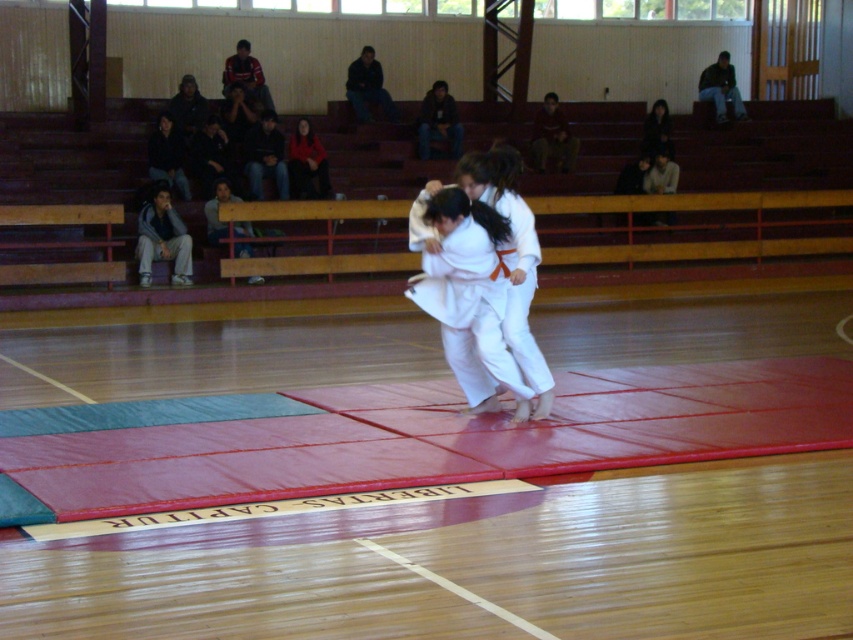
Question: Considering the relative positions of white cotton kimono at center and red velvet sweater at center in the image provided, where is white cotton kimono at center located with respect to red velvet sweater at center?

Choices:
 (A) right
 (B) left

Answer: (A)

Question: Considering the real-world distances, which object is farthest from the dark fabric jacket at upper left?

Choices:
 (A) white cotton kimono at center
 (B) red velvet sweater at center
 (C) dark brown hair at upper right

Answer: (A)

Question: Considering the relative positions of red velvet sweater at center and dark fabric jacket at upper left in the image provided, where is red velvet sweater at center located with respect to dark fabric jacket at upper left?

Choices:
 (A) above
 (B) below

Answer: (A)

Question: Which point is closer to the camera?

Choices:
 (A) (672, 147)
 (B) (306, 132)

Answer: (B)

Question: Which point appears farthest from the camera in this image?

Choices:
 (A) (657, 122)
 (B) (299, 141)
 (C) (164, 168)

Answer: (A)

Question: Can you confirm if white cotton kimono at center is thinner than dark brown hair at upper right?

Choices:
 (A) yes
 (B) no

Answer: (B)